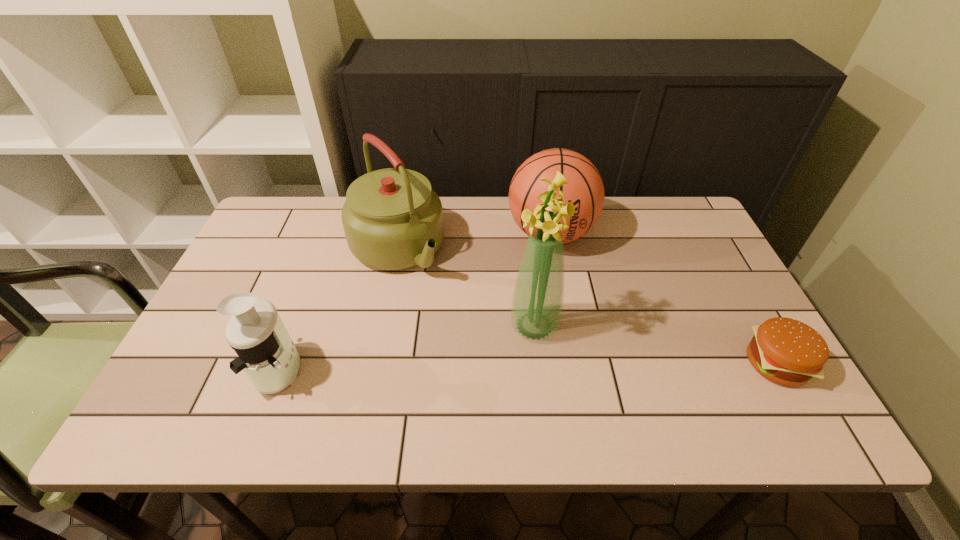
Image resolution: width=960 pixels, height=540 pixels. Identify the location of vacant area at the near right corner. pyautogui.click(x=720, y=392).

This screenshot has width=960, height=540. I want to click on vacant space in between the kettle and the hamburger, so click(x=587, y=306).

You are a GUI agent. You are given a task and a screenshot of the screen. Output one action in this format:
    pyautogui.click(x=<x>, y=<y>)
    Task: Click on the blank region between the leftmost object and the rightmost object
    
    Given the screenshot: What is the action you would take?
    pyautogui.click(x=528, y=366)

This screenshot has height=540, width=960. What are the coordinates of `free space between the basketball and the hamburger` in the screenshot? It's located at (663, 298).

Identify the location of vacant space in between the tallest object and the fourth object from right to left. Image resolution: width=960 pixels, height=540 pixels. (466, 287).

Where is `free space between the juicer and the kettle`? This screenshot has height=540, width=960. free space between the juicer and the kettle is located at coordinates (339, 309).

Where is `vacant point located between the bouquet and the second tallest object`? The image size is (960, 540). vacant point located between the bouquet and the second tallest object is located at coordinates (466, 287).

This screenshot has width=960, height=540. Find the location of `unoccupied area between the shortest object and the juicer`. unoccupied area between the shortest object and the juicer is located at coordinates (528, 366).

Find the location of a particular element. The width and height of the screenshot is (960, 540). vacant space that's between the juicer and the basketball is located at coordinates (416, 301).

Where is `object that stands as the second closest to the rightmost object`? object that stands as the second closest to the rightmost object is located at coordinates click(x=537, y=302).